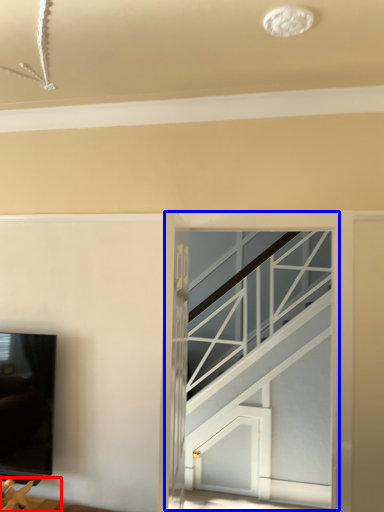
Question: Which point is closer to the camera, furniture (highlighted by a red box) or glass door (highlighted by a blue box)?

Choices:
 (A) furniture
 (B) glass door

Answer: (A)